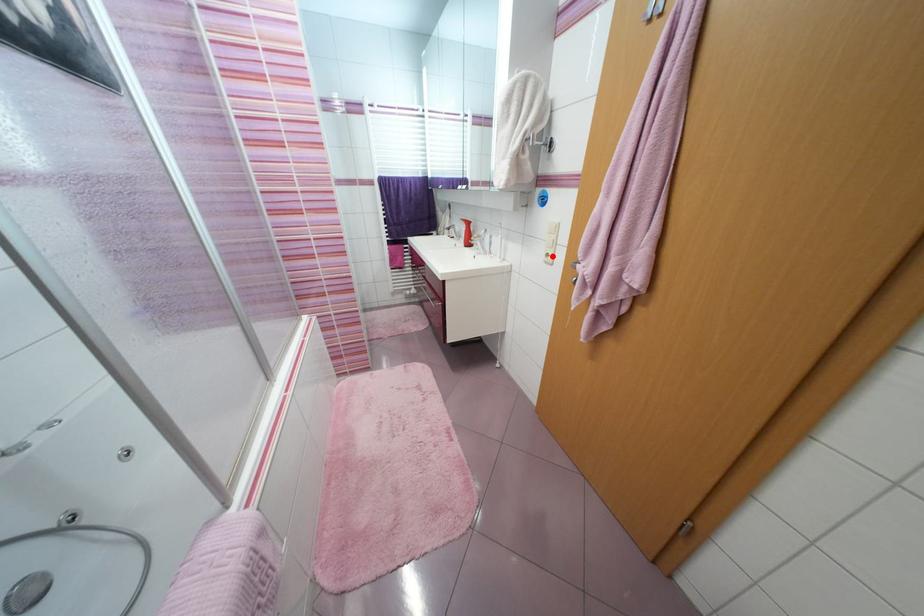
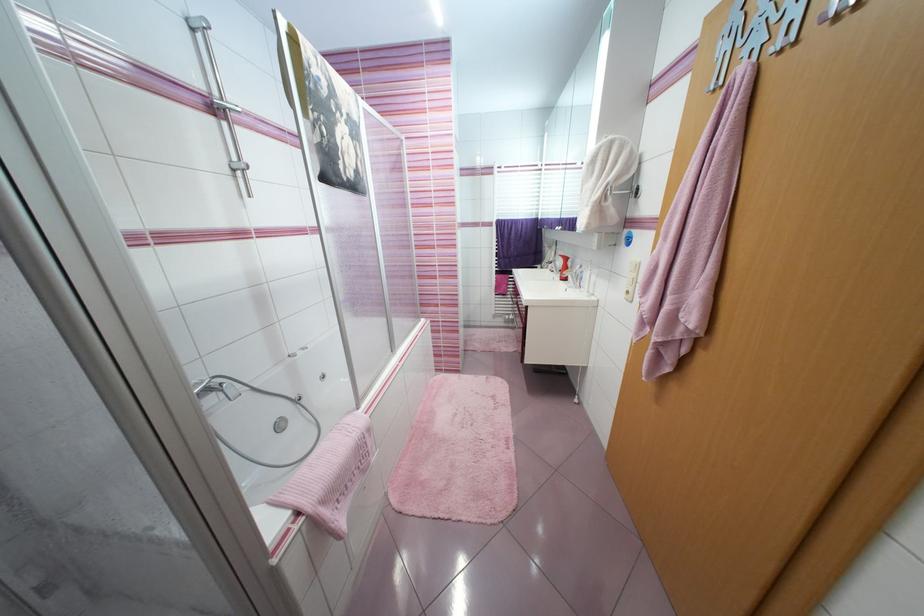
Question: I am providing you with two images of the same scene from different viewpoints. Image1 has a red point marked. In image2, the corresponding 3D location appears at what relative position? Reply with the corresponding letter.

Choices:
 (A) Closer
 (B) Farther

Answer: (A)